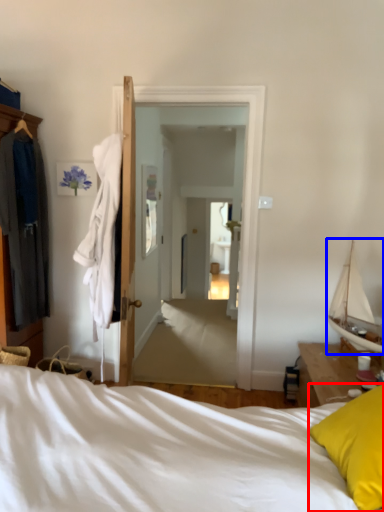
Question: Which of the following is the closest to the observer, pillow (highlighted by a red box) or boat (highlighted by a blue box)?

Choices:
 (A) pillow
 (B) boat

Answer: (A)